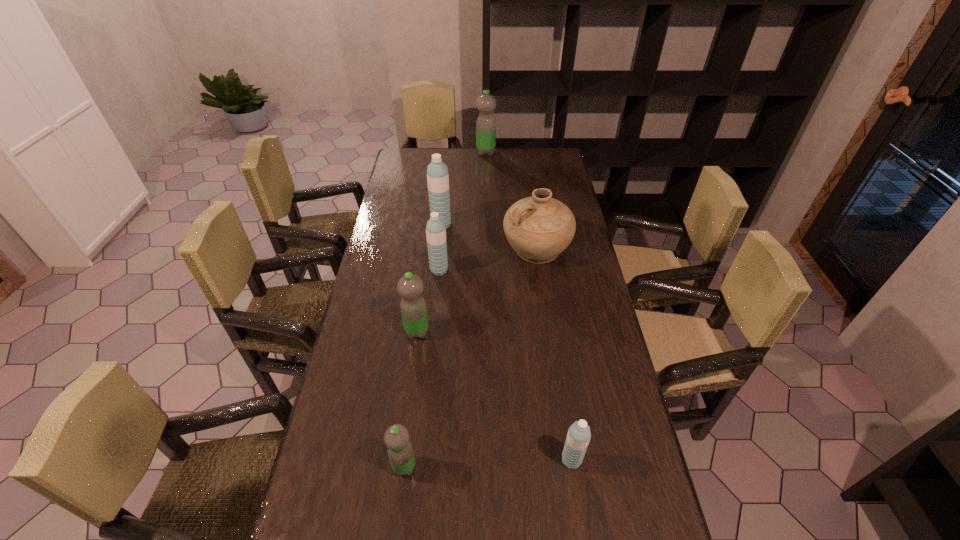
Where is `the rightmost water bottle`? the rightmost water bottle is located at coordinates (578, 437).

Locate an element on the screen. Image resolution: width=960 pixels, height=540 pixels. the nearest green water bottle is located at coordinates (396, 438).

This screenshot has width=960, height=540. I want to click on free spot located on the right of the rightmost green water bottle, so click(x=546, y=152).

Identify the location of vacant space located 0.270m on the front of the second farthest water bottle. The width and height of the screenshot is (960, 540). (436, 279).

You are a GUI agent. You are given a task and a screenshot of the screen. Output one action in this format:
    pyautogui.click(x=<x>, y=<y>)
    Task: Click on the vacant space located on the back of the pottery
    
    Given the screenshot: What is the action you would take?
    pyautogui.click(x=527, y=183)

Find the location of a particular element. Image resolution: width=960 pixels, height=540 pixels. free spot located on the back of the third nearest water bottle is located at coordinates (428, 246).

Locate an element on the screen. The height and width of the screenshot is (540, 960). vacant space located 0.380m on the right of the third farthest water bottle is located at coordinates (556, 270).

I want to click on free space located on the front of the smallest blue water bottle, so click(x=582, y=531).

Find the location of a particular element. This screenshot has height=540, width=960. free location located 0.320m on the right of the nearest green water bottle is located at coordinates (549, 467).

I want to click on object positioned at the far edge, so click(x=486, y=103).